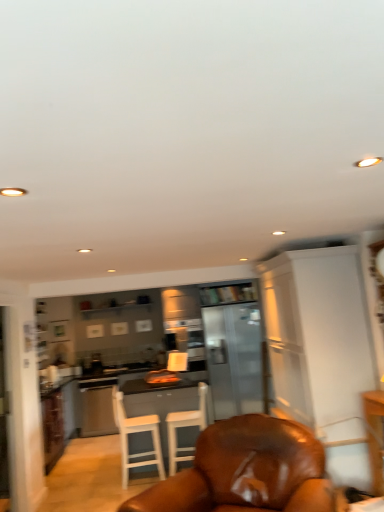
Question: From a real-world perspective, is satin silver dishwasher at center positioned above or below brown leather chair at center, which is counted as the third chair, starting from the back?

Choices:
 (A) below
 (B) above

Answer: (A)

Question: Looking at the image, does satin silver dishwasher at center seem bigger or smaller compared to brown leather chair at center, arranged as the first chair when viewed from the front?

Choices:
 (A) big
 (B) small

Answer: (B)

Question: Based on their relative distances, which object is farther from the white wood chair at center, acting as the second chair starting from the back?

Choices:
 (A) satin silver dishwasher at center
 (B) white wood chair at center, the third chair positioned from the front
 (C) white glossy cabinet at right
 (D) brown leather chair at center, arranged as the first chair when viewed from the front
 (E) wooden bookshelf at center

Answer: (C)

Question: Which of these objects is positioned closest to the white glossy cabinet at right?

Choices:
 (A) satin silver dishwasher at center
 (B) white wood chair at center, the second chair viewed from the front
 (C) wooden bookshelf at center
 (D) white wood chair at center, placed as the first chair when sorted from back to front
 (E) brown leather chair at center, which is counted as the third chair, starting from the back

Answer: (E)